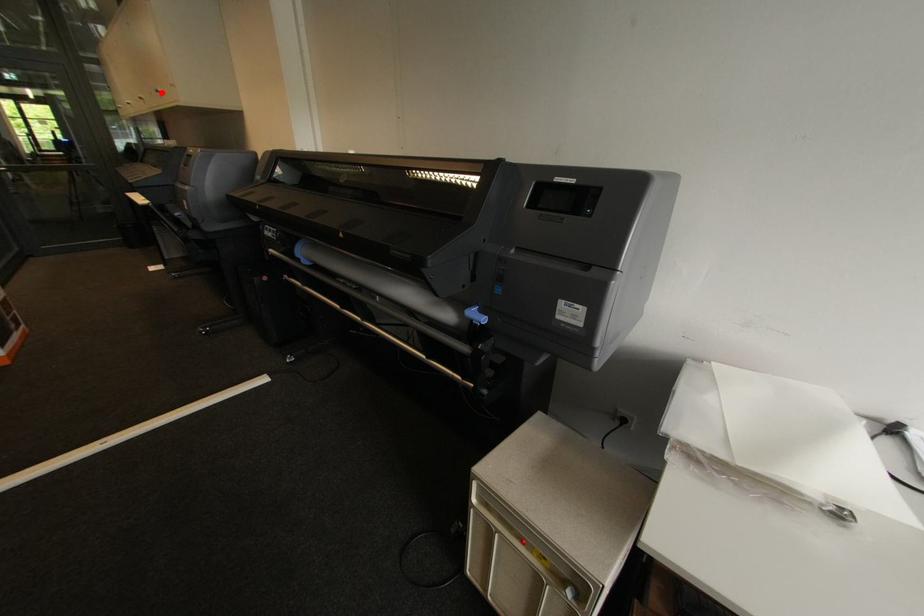
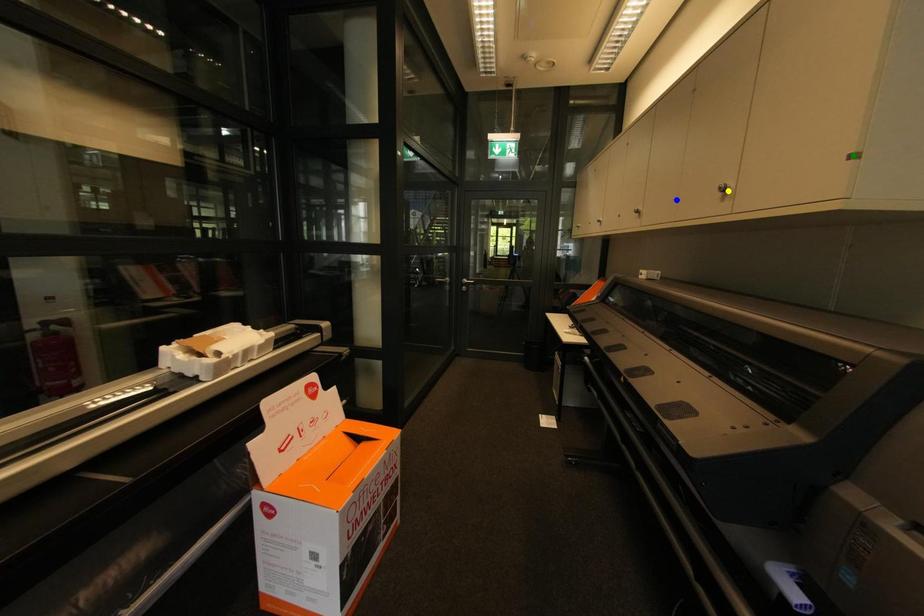
Question: I am providing you with two images of the same scene from different viewpoints. A red point is marked on the first image. You are given multiple points on the second image. Which point in image 2 represents the same 3d spot as the red point in image 1?

Choices:
 (A) green point
 (B) blue point
 (C) yellow point

Answer: (C)